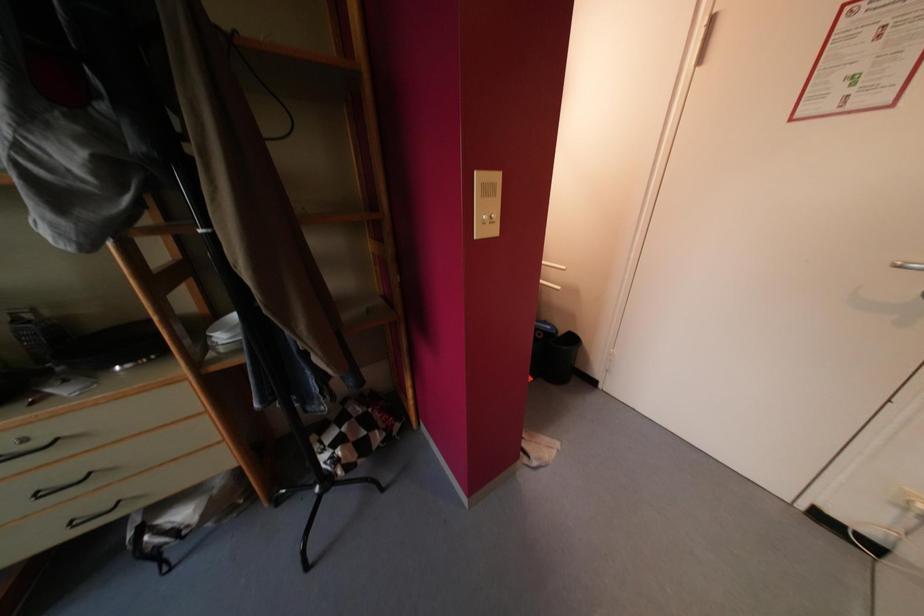
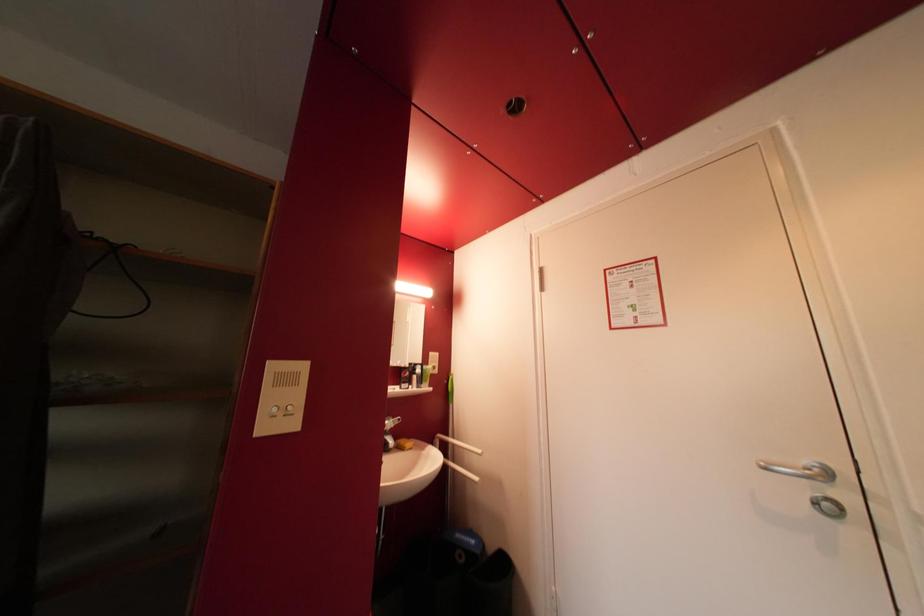
Question: The images are taken continuously from a first-person perspective. In which direction is your viewpoint rotating?

Choices:
 (A) Left
 (B) Right
 (C) Up
 (D) Down

Answer: (C)